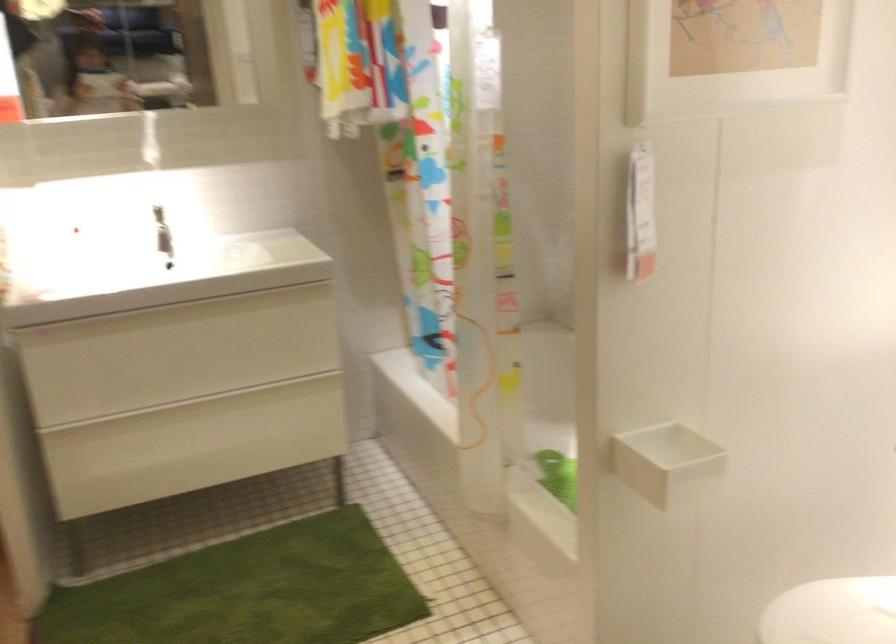
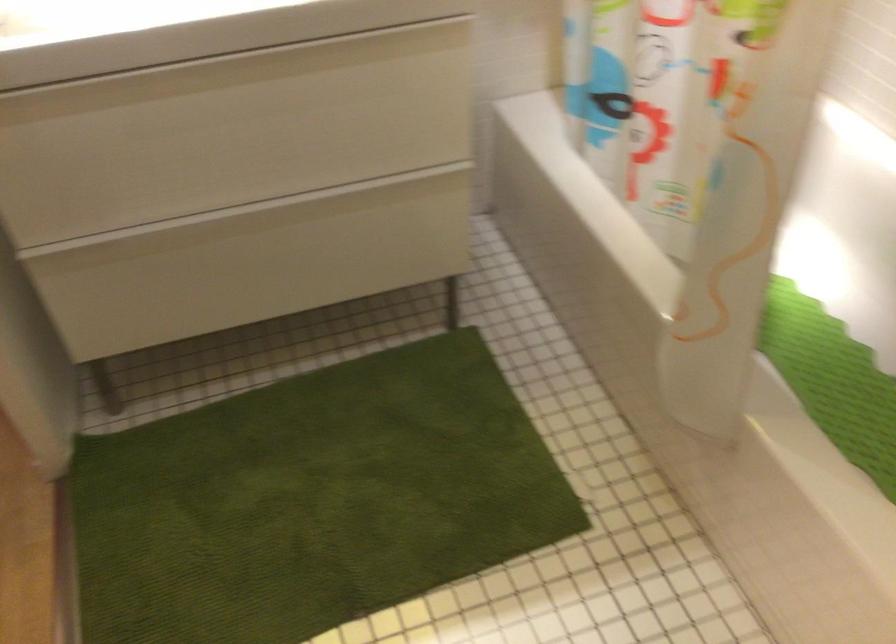
Find the pixel in the second image that matches the point at 194,310 in the first image.

(228, 70)